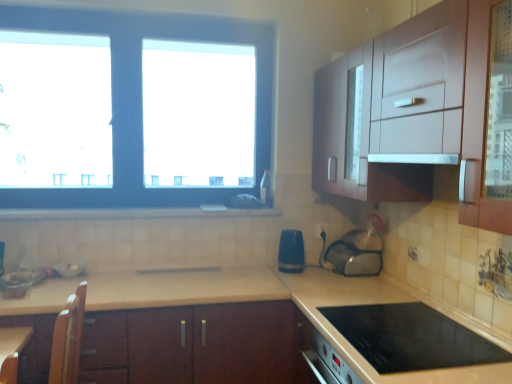
Question: Does white tile at lower center have a greater height compared to transparent plastic bag at center, the third appliance from the left?

Choices:
 (A) no
 (B) yes

Answer: (A)

Question: Is white tile at lower center to the right of transparent plastic bag at center, the third appliance from the left, from the viewer's perspective?

Choices:
 (A) no
 (B) yes

Answer: (A)

Question: Are white tile at lower center and transparent plastic bag at center, the third appliance from the left, located far from each other?

Choices:
 (A) no
 (B) yes

Answer: (A)

Question: From a real-world perspective, is white tile at lower center over transparent plastic bag at center, marked as the 1th appliance in a right-to-left arrangement?

Choices:
 (A) yes
 (B) no

Answer: (A)

Question: Can you confirm if white tile at lower center is smaller than transparent plastic bag at center, the third appliance from the left?

Choices:
 (A) yes
 (B) no

Answer: (B)

Question: From a real-world perspective, is white tile at lower center located beneath transparent plastic bag at center, marked as the 1th appliance in a right-to-left arrangement?

Choices:
 (A) no
 (B) yes

Answer: (A)

Question: Is metallic silver bowl at lower left, which ranks as the 1th appliance in left-to-right order, not inside white tile at lower center?

Choices:
 (A) no
 (B) yes

Answer: (B)

Question: Considering the relative sizes of metallic silver bowl at lower left, which ranks as the 1th appliance in left-to-right order, and white tile at lower center in the image provided, is metallic silver bowl at lower left, which ranks as the 1th appliance in left-to-right order, shorter than white tile at lower center?

Choices:
 (A) no
 (B) yes

Answer: (B)

Question: Can you see metallic silver bowl at lower left, which is the third appliance from right to left, touching white tile at lower center?

Choices:
 (A) yes
 (B) no

Answer: (B)

Question: Is metallic silver bowl at lower left, which ranks as the 1th appliance in left-to-right order, taller than white tile at lower center?

Choices:
 (A) no
 (B) yes

Answer: (A)

Question: Does metallic silver bowl at lower left, which ranks as the 1th appliance in left-to-right order, have a greater width compared to white tile at lower center?

Choices:
 (A) no
 (B) yes

Answer: (B)

Question: From a real-world perspective, does metallic silver bowl at lower left, which ranks as the 1th appliance in left-to-right order, sit lower than white tile at lower center?

Choices:
 (A) no
 (B) yes

Answer: (B)

Question: Does white glossy exhaust hood at upper right come behind transparent plastic bag at center, the third appliance from the left?

Choices:
 (A) no
 (B) yes

Answer: (A)